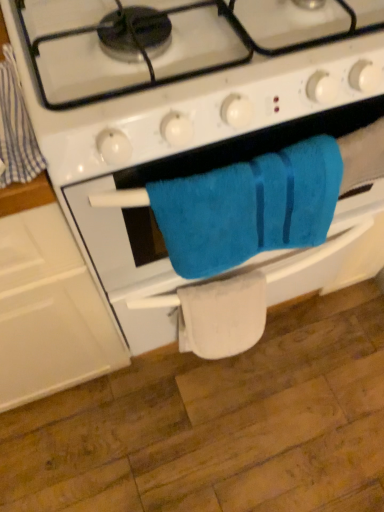
Image resolution: width=384 pixels, height=512 pixels. What do you see at coordinates (249, 207) in the screenshot? I see `turquoise soft towel at center` at bounding box center [249, 207].

Identify the location of blue cotton towel at left. Image resolution: width=384 pixels, height=512 pixels. (16, 128).

How distant is blue soft towel at center from blue cotton towel at left?

They are 9.85 inches apart.

Is blue soft towel at center at the left side of blue cotton towel at left?

Incorrect, blue soft towel at center is not on the left side of blue cotton towel at left.

Does blue soft towel at center have a smaller size compared to blue cotton towel at left?

No, blue soft towel at center is not smaller than blue cotton towel at left.

Which object is closer to the camera, blue soft towel at center or blue cotton towel at left?

→ blue cotton towel at left.

How far apart are white fabric towel at lower center and turquoise soft towel at center?

They are 8.93 inches apart.

Is white fabric towel at lower center wider than turquoise soft towel at center?

Yes.

Would you say white fabric towel at lower center is outside turquoise soft towel at center?

white fabric towel at lower center lies outside turquoise soft towel at center's area.

The height and width of the screenshot is (512, 384). What are the coordinates of `towel/napkin above the white fabric towel at lower center (from a real-world perspective)` in the screenshot? It's located at (249, 207).

Based on the photo, is turquoise soft towel at center far away from white fabric towel at lower center?

That's not correct — turquoise soft towel at center is a little close to white fabric towel at lower center.

Who is more distant, turquoise soft towel at center or white fabric towel at lower center?

Positioned behind is white fabric towel at lower center.

From the image's perspective, which one is positioned lower, turquoise soft towel at center or white fabric towel at lower center?

white fabric towel at lower center appears lower in the image.

Is blue cotton towel at left directly adjacent to blue soft towel at center?

No, blue cotton towel at left is not making contact with blue soft towel at center.

Based on the photo, does blue cotton towel at left turn towards blue soft towel at center?

No, blue cotton towel at left is not facing towards blue soft towel at center.

From their relative heights in the image, would you say blue cotton towel at left is taller or shorter than blue soft towel at center?

In the image, blue cotton towel at left appears to be shorter than blue soft towel at center.

In terms of size, does blue cotton towel at left appear bigger or smaller than blue soft towel at center?

Considering their sizes, blue cotton towel at left takes up less space than blue soft towel at center.

Can you tell me how much white fabric towel at lower center and blue cotton towel at left differ in facing direction?

white fabric towel at lower center and blue cotton towel at left are facing 2.32 degrees away from each other.

Can you confirm if white fabric towel at lower center is wider than blue cotton towel at left?

No, white fabric towel at lower center is not wider than blue cotton towel at left.

Which object is closer to the camera, white fabric towel at lower center or blue cotton towel at left?

Positioned in front is blue cotton towel at left.

How far apart are white fabric towel at lower center and blue cotton towel at left?

48.51 centimeters.

Are turquoise soft towel at center and blue soft towel at center far apart?

No, turquoise soft towel at center is not far from blue soft towel at center.

Is point (256, 166) behind point (319, 106)?

No, it is in front of (319, 106).

From the image's perspective, which one is positioned lower, turquoise soft towel at center or blue soft towel at center?

turquoise soft towel at center appears lower in the image.

Considering the sizes of objects turquoise soft towel at center and blue soft towel at center in the image provided, who is smaller, turquoise soft towel at center or blue soft towel at center?

Smaller between the two is turquoise soft towel at center.

Consider the image. Is there a large distance between blue soft towel at center and turquoise soft towel at center?

No, blue soft towel at center is in close proximity to turquoise soft towel at center.

Is blue soft towel at center turned away from turquoise soft towel at center?

blue soft towel at center does not have its back to turquoise soft towel at center.

The image size is (384, 512). I want to click on gas stove beneath the turquoise soft towel at center (from a real-world perspective), so click(x=168, y=135).

Locate an element on the screen. The height and width of the screenshot is (512, 384). beach towel that appears in front of the blue soft towel at center is located at coordinates (16, 128).

This screenshot has height=512, width=384. I want to click on towel/napkin on the right of white fabric towel at lower center, so click(x=249, y=207).

Considering their positions, is white fabric towel at lower center positioned closer to blue cotton towel at left than blue soft towel at center?

blue soft towel at center is closer to blue cotton towel at left.

Considering their positions, is blue cotton towel at left positioned closer to blue soft towel at center than turquoise soft towel at center?

Based on the image, turquoise soft towel at center appears to be nearer to blue soft towel at center.

When comparing their distances from turquoise soft towel at center, does blue cotton towel at left or white fabric towel at lower center seem further?

blue cotton towel at left.

From the image, which object appears to be nearer to turquoise soft towel at center, blue soft towel at center or white fabric towel at lower center?

blue soft towel at center.

Based on their spatial positions, is blue soft towel at center or blue cotton towel at left further from white fabric towel at lower center?

blue cotton towel at left lies further to white fabric towel at lower center than the other object.

Which object lies nearer to the anchor point white fabric towel at lower center, turquoise soft towel at center or blue soft towel at center?

turquoise soft towel at center lies closer to white fabric towel at lower center than the other object.

Estimate the real-world distances between objects in this image. Which object is closer to turquoise soft towel at center, blue cotton towel at left or blue soft towel at center?

The object closer to turquoise soft towel at center is blue soft towel at center.

Estimate the real-world distances between objects in this image. Which object is further from white fabric towel at lower center, turquoise soft towel at center or blue cotton towel at left?

blue cotton towel at left is further to white fabric towel at lower center.

Where is `toilet paper between blue cotton towel at left and turquoise soft towel at center`? The width and height of the screenshot is (384, 512). toilet paper between blue cotton towel at left and turquoise soft towel at center is located at coordinates (222, 316).

Identify the location of towel/napkin between blue soft towel at center and white fabric towel at lower center from top to bottom. This screenshot has height=512, width=384. (249, 207).

At what (x,y) coordinates should I click in order to perform the action: click on gas stove between blue cotton towel at left and white fabric towel at lower center. Please return your answer as a coordinate pair (x, y). The image size is (384, 512). Looking at the image, I should click on (168, 135).

Find the location of a particular element. The width and height of the screenshot is (384, 512). gas stove between blue cotton towel at left and turquoise soft towel at center is located at coordinates (168, 135).